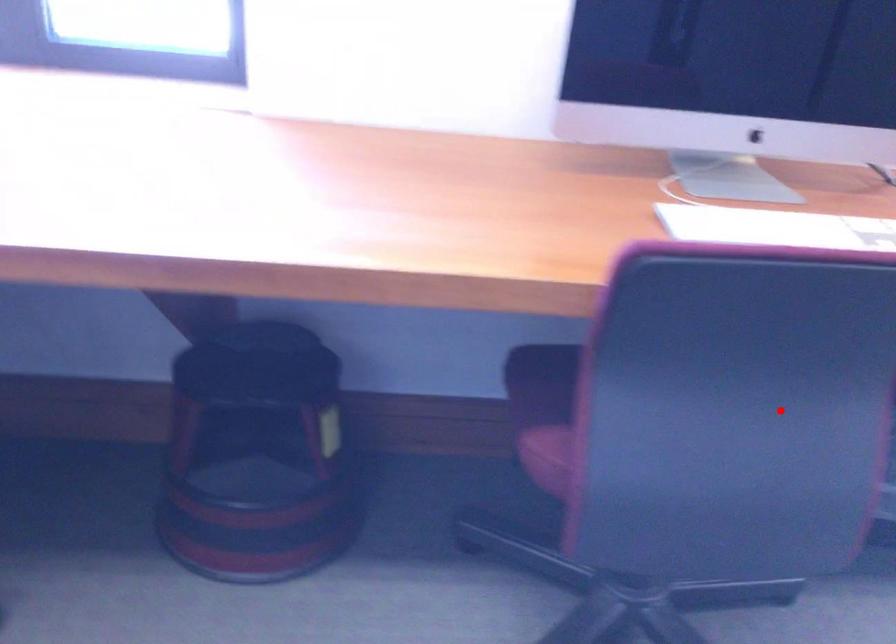
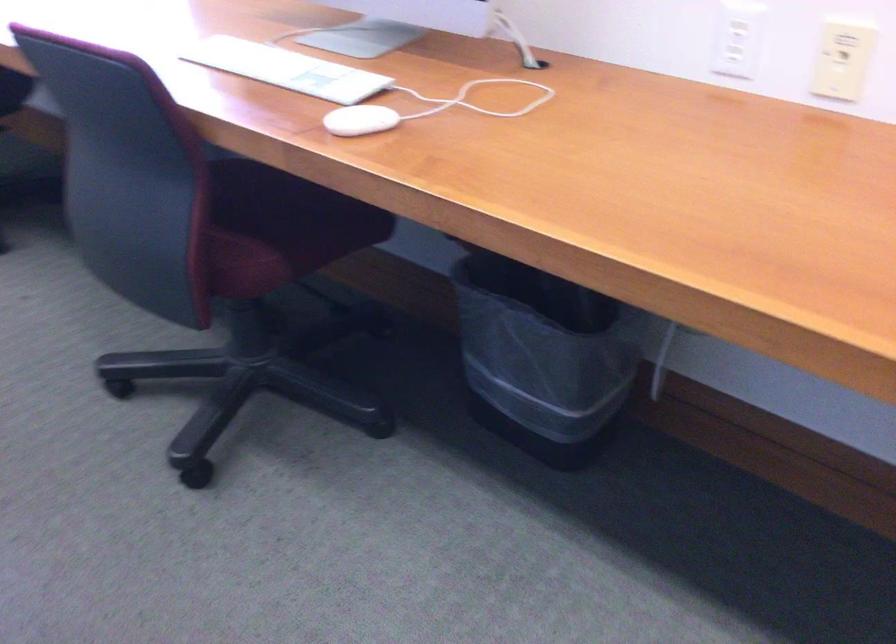
Question: I am providing you with two images of the same scene from different viewpoints. A red point is marked on the first image. At the location where the point appears in image 1, is it still visible in image 2?

Choices:
 (A) Yes
 (B) No

Answer: (A)